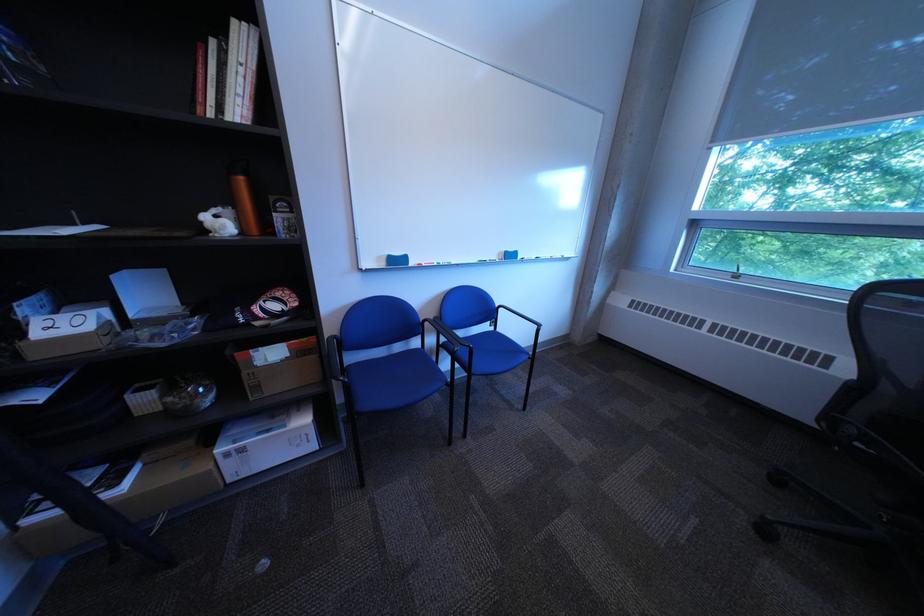
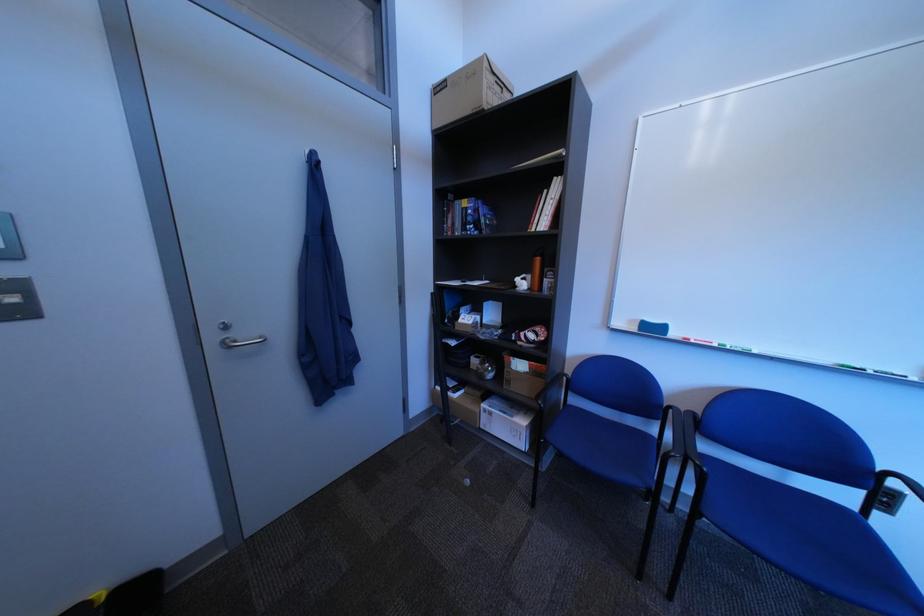
Locate, in the second image, the point that corresponds to (x=221, y=213) in the first image.

(535, 278)